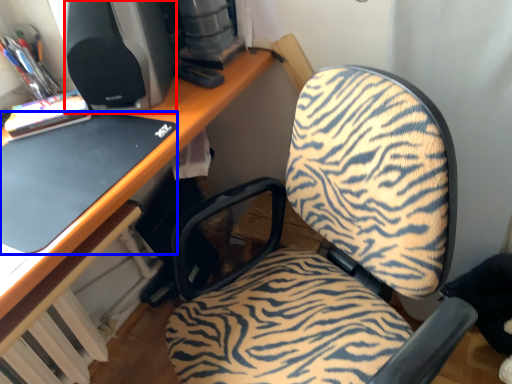
Question: Among these objects, which one is nearest to the camera, desktop computer (highlighted by a red box) or laptop (highlighted by a blue box)?

Choices:
 (A) desktop computer
 (B) laptop

Answer: (B)